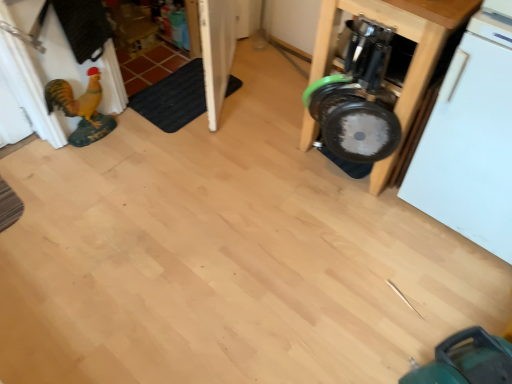
Locate an element on the screen. vacant space in front of white matte dishwasher at right is located at coordinates (445, 297).